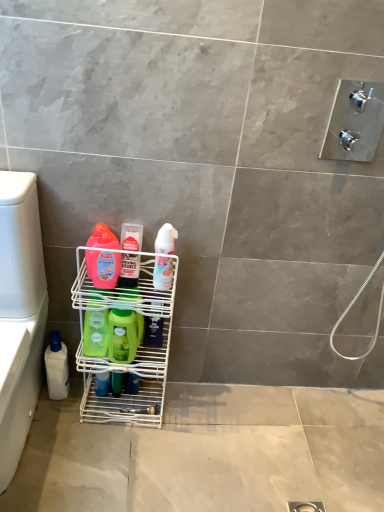
Question: Considering the positions of point (152, 282) and point (26, 328), is point (152, 282) closer or farther from the camera than point (26, 328)?

Choices:
 (A) closer
 (B) farther

Answer: (B)

Question: In terms of width, does white wire rack at lower left look wider or thinner when compared to white plastic bottle at lower left?

Choices:
 (A) wide
 (B) thin

Answer: (B)

Question: Which is farther from the white wire rack at lower left?

Choices:
 (A) green matte bottle at center, which ranks as the 2th cleaning product in left-to-right order
 (B) green matte bottle at center, the fourth cleaning product from the left
 (C) white plastic bottle at lower left, the seventh cleaning product positioned from the right
 (D) translucent plastic bottle at center, which appears as the 5th cleaning product when viewed from the left
 (E) white glossy lotion at center, the 7th cleaning product positioned from the left

Answer: (C)

Question: Which object is the farthest from the white plastic bottle at lower left?

Choices:
 (A) white glossy lotion at center, the first cleaning product positioned from the right
 (B) translucent plastic bottle at center, arranged as the third cleaning product when viewed from the right
 (C) matte pink bottle at center left, acting as the fifth cleaning product starting from the right
 (D) white wire rack at lower left
 (E) white plastic bottle at lower left, the seventh cleaning product positioned from the right

Answer: (A)